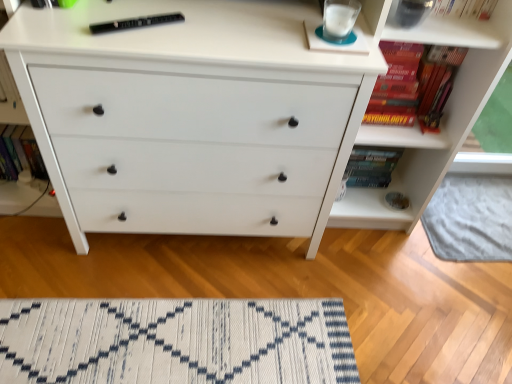
The width and height of the screenshot is (512, 384). What do you see at coordinates (136, 23) in the screenshot?
I see `black plastic remote at upper center, the third book viewed from the right` at bounding box center [136, 23].

The image size is (512, 384). What are the coordinates of `hardcover book at upper right, acting as the 2th book starting from the right` in the screenshot? It's located at (372, 166).

In order to face hardcover book at left, marked as the 4th book in a right-to-left arrangement, should I rotate leftwards or rightwards?

Rotate left and turn 29.494 degrees.

You are a GUI agent. You are given a task and a screenshot of the screen. Output one action in this format:
    pyautogui.click(x=<x>, y=<y>)
    Task: Click on the white textured rug at lower center
    This screenshot has width=512, height=384.
    Given the screenshot: What is the action you would take?
    pos(471,219)

Which is in front, hardcover book at upper right, arranged as the 3th book when viewed from the left, or black plastic remote at upper center, placed as the second book when sorted from left to right?

black plastic remote at upper center, placed as the second book when sorted from left to right.

Which of these two, hardcover book at upper right, arranged as the 3th book when viewed from the left, or black plastic remote at upper center, the third book viewed from the right, stands shorter?

Standing shorter between the two is black plastic remote at upper center, the third book viewed from the right.

Considering the relative sizes of hardcover book at upper right, acting as the 2th book starting from the right, and black plastic remote at upper center, placed as the second book when sorted from left to right, in the image provided, is hardcover book at upper right, acting as the 2th book starting from the right, bigger than black plastic remote at upper center, placed as the second book when sorted from left to right,?

Yes.

Is the surface of hardcover book at upper right, arranged as the 3th book when viewed from the left, in direct contact with black plastic remote at upper center, placed as the second book when sorted from left to right?

hardcover book at upper right, arranged as the 3th book when viewed from the left, and black plastic remote at upper center, placed as the second book when sorted from left to right, are not in contact.

Consider the image. Is white woven mat at lower center to the left of hardcover book at upper right, arranged as the 3th book when viewed from the left, from the viewer's perspective?

Correct, you'll find white woven mat at lower center to the left of hardcover book at upper right, arranged as the 3th book when viewed from the left.

Is white woven mat at lower center situated inside hardcover book at upper right, acting as the 2th book starting from the right, or outside?

white woven mat at lower center is spatially situated outside hardcover book at upper right, acting as the 2th book starting from the right.

You are a GUI agent. You are given a task and a screenshot of the screen. Output one action in this format:
    pyautogui.click(x=<x>, y=<y>)
    Task: Click on the 1st book to the right of the white woven mat at lower center, counting from the anchor's position
    
    Given the screenshot: What is the action you would take?
    pyautogui.click(x=372, y=166)

Where is `mat behind the white matte chest of drawers at center`? This screenshot has width=512, height=384. mat behind the white matte chest of drawers at center is located at coordinates (175, 341).

Which of these two, white matte chest of drawers at center or white woven mat at lower center, is thinner?

white woven mat at lower center is thinner.

In terms of height, does white matte chest of drawers at center look taller or shorter compared to white woven mat at lower center?

white matte chest of drawers at center is taller than white woven mat at lower center.

From a real-world perspective, is hardcover book at upper right, arranged as the 3th book when viewed from the left, positioned under hardcover book at left, acting as the first book starting from the left, based on gravity?

No.

Is hardcover book at upper right, acting as the 2th book starting from the right, with hardcover book at left, acting as the first book starting from the left?

hardcover book at upper right, acting as the 2th book starting from the right, is not next to hardcover book at left, acting as the first book starting from the left, and they're not touching.

Which of these two, hardcover book at upper right, arranged as the 3th book when viewed from the left, or hardcover book at left, marked as the 4th book in a right-to-left arrangement, stands taller?

hardcover book at upper right, arranged as the 3th book when viewed from the left, is taller.

Which object is further away from the camera taking this photo, black plastic remote at upper center, placed as the second book when sorted from left to right, or hardcover book at upper right, arranged as the 3th book when viewed from the left?

hardcover book at upper right, arranged as the 3th book when viewed from the left.

Locate an element on the screen. the 1st book counting from the left side of the hardcover book at upper right, acting as the 2th book starting from the right is located at coordinates (x=136, y=23).

Which of these two, black plastic remote at upper center, placed as the second book when sorted from left to right, or hardcover book at upper right, arranged as the 3th book when viewed from the left, stands shorter?

Standing shorter between the two is black plastic remote at upper center, placed as the second book when sorted from left to right.

Which object is positioned more to the right, hardcover book at upper right, positioned as the 1th book in right-to-left order, or white matte chest of drawers at center?

From the viewer's perspective, hardcover book at upper right, positioned as the 1th book in right-to-left order, appears more on the right side.

Considering the relative sizes of hardcover book at upper right, positioned as the 1th book in right-to-left order, and white matte chest of drawers at center in the image provided, is hardcover book at upper right, positioned as the 1th book in right-to-left order, thinner than white matte chest of drawers at center?

Yes, hardcover book at upper right, positioned as the 1th book in right-to-left order, is thinner than white matte chest of drawers at center.

In terms of size, does hardcover book at upper right, positioned as the 1th book in right-to-left order, appear bigger or smaller than white matte chest of drawers at center?

hardcover book at upper right, positioned as the 1th book in right-to-left order, is smaller than white matte chest of drawers at center.

From the image's perspective, between white matte chest of drawers at center and hardcover book at left, marked as the 4th book in a right-to-left arrangement, who is located below?

hardcover book at left, marked as the 4th book in a right-to-left arrangement.

Is white matte chest of drawers at center not close to hardcover book at left, marked as the 4th book in a right-to-left arrangement?

No.

What's the angular difference between white matte chest of drawers at center and hardcover book at left, marked as the 4th book in a right-to-left arrangement,'s facing directions?

white matte chest of drawers at center and hardcover book at left, marked as the 4th book in a right-to-left arrangement, are facing 0.986 degrees away from each other.

Considering the relative positions of white matte chest of drawers at center and hardcover book at left, acting as the first book starting from the left, in the image provided, is white matte chest of drawers at center to the left of hardcover book at left, acting as the first book starting from the left, from the viewer's perspective?

Incorrect, white matte chest of drawers at center is not on the left side of hardcover book at left, acting as the first book starting from the left.

From the image's perspective, which book is the 3rd one above the hardcover book at upper right, arranged as the 3th book when viewed from the left? Please provide its 2D coordinates.

[(136, 23)]

Locate an element on the screen. mat below the hardcover book at upper right, acting as the 2th book starting from the right (from a real-world perspective) is located at coordinates (175, 341).

Which object lies further to the anchor point white matte chest of drawers at center, black plastic remote at upper center, the third book viewed from the right, or hardcover book at upper right, acting as the 2th book starting from the right?

hardcover book at upper right, acting as the 2th book starting from the right.

Estimate the real-world distances between objects in this image. Which object is closer to black plastic remote at upper center, placed as the second book when sorted from left to right, hardcover book at upper right, positioned as the 1th book in right-to-left order, or hardcover book at left, acting as the first book starting from the left?

hardcover book at left, acting as the first book starting from the left, lies closer to black plastic remote at upper center, placed as the second book when sorted from left to right, than the other object.

Considering their positions, is white textured rug at lower center positioned closer to white woven mat at lower center than black plastic remote at upper center, the third book viewed from the right?

Based on the image, white textured rug at lower center appears to be nearer to white woven mat at lower center.

Based on their spatial positions, is black plastic remote at upper center, placed as the second book when sorted from left to right, or white matte chest of drawers at center closer to hardcover book at left, acting as the first book starting from the left?

white matte chest of drawers at center is closer to hardcover book at left, acting as the first book starting from the left.

Considering their positions, is white textured rug at lower center positioned further to hardcover book at left, marked as the 4th book in a right-to-left arrangement, than hardcover book at upper right, positioned as the 1th book in right-to-left order?

white textured rug at lower center is positioned further to the anchor hardcover book at left, marked as the 4th book in a right-to-left arrangement.

Considering their positions, is hardcover book at upper right, acting as the 2th book starting from the right, positioned closer to white woven mat at lower center than white matte chest of drawers at center?

white matte chest of drawers at center is closer to white woven mat at lower center.

When comparing their distances from hardcover book at left, marked as the 4th book in a right-to-left arrangement, does hardcover book at upper right, arranged as the 3th book when viewed from the left, or hardcover book at upper right, positioned as the 1th book in right-to-left order, seem closer?

The object closer to hardcover book at left, marked as the 4th book in a right-to-left arrangement, is hardcover book at upper right, arranged as the 3th book when viewed from the left.

Consider the image. Estimate the real-world distances between objects in this image. Which object is closer to hardcover book at left, acting as the first book starting from the left, white matte chest of drawers at center or hardcover book at upper right, acting as the 2th book starting from the right?

white matte chest of drawers at center is positioned closer to the anchor hardcover book at left, acting as the first book starting from the left.

Locate an element on the screen. This screenshot has width=512, height=384. chest of drawers between black plastic remote at upper center, the third book viewed from the right, and white textured rug at lower center from left to right is located at coordinates (192, 115).

The image size is (512, 384). I want to click on the chest of drawers located between hardcover book at left, marked as the 4th book in a right-to-left arrangement, and hardcover book at upper right, positioned as the 1th book in right-to-left order, in the left-right direction, so click(192, 115).

Image resolution: width=512 pixels, height=384 pixels. In order to click on mat between hardcover book at left, marked as the 4th book in a right-to-left arrangement, and hardcover book at upper right, positioned as the 1th book in right-to-left order, from left to right in this screenshot , I will do `click(175, 341)`.

I want to click on book between hardcover book at left, acting as the first book starting from the left, and hardcover book at upper right, acting as the 2th book starting from the right, in the horizontal direction, so click(x=136, y=23).